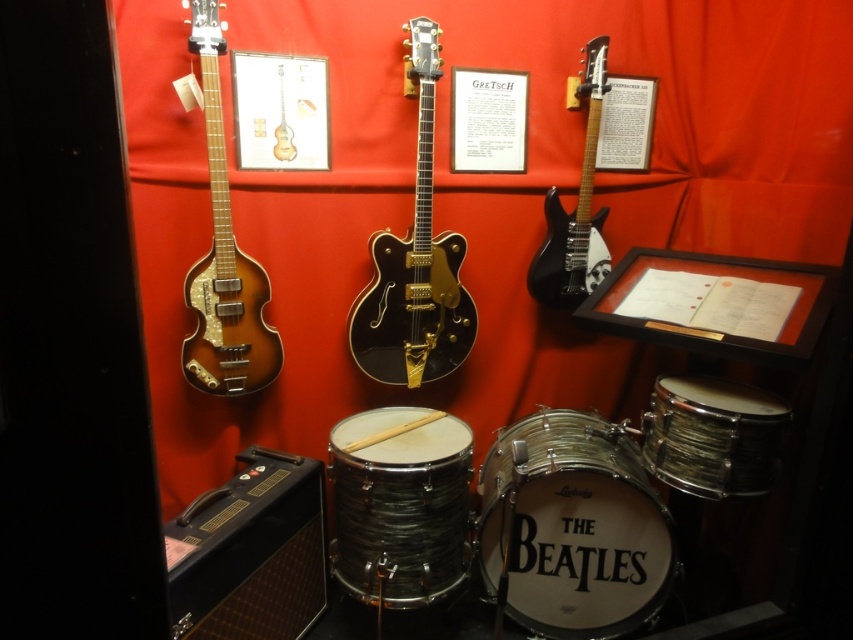
You are a museum curator planning to install a motion sensor to monitor the black textured drum at center. The sensor has a maximum range of 0.8 meters. If the sensor is placed at point origin, can it detect the drum?

The black textured drum at center is located at point (399, 506). Calculating the distance from the origin, the distance is sqrt0.792 squared plus 0.469 squared equals approximately 0.916 meters. Since the sensor has a maximum range of 0.8 meters, it cannot detect the drum.

You are a museum curator arranging an exhibit. You need to ensure that the glossy black guitar at center and the wooden snare drum at lower right are visible to visitors standing at the entrance. Considering their heights, which object will require a taller display stand to ensure visibility?

The glossy black guitar at center is taller than the wooden snare drum at lower right, so it will require a taller display stand to ensure visibility.

You are a museum curator planning to move the white leather drum at lower right and the glossy black guitar at center to a new exhibition space. The new space has a height restriction of 1.2 meters. Can both items fit vertically without any adjustments?

The white leather drum at lower right is larger than the glossy black guitar at center. However, the exact height of both items isn not specified in the provided description. Therefore, it is uncertain whether they will fit within the 1.2 meter height restriction without additional information.